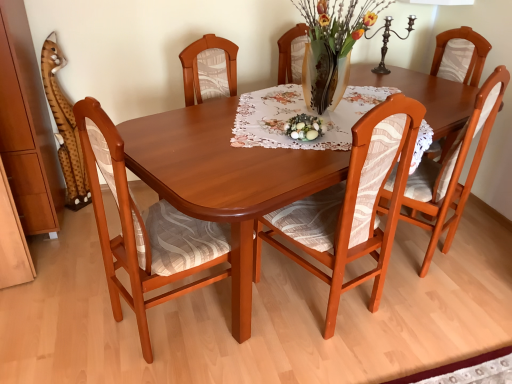
Identify the location of free point to the right of matte wood chair at center, acting as the third chair starting from the left. (480, 251).